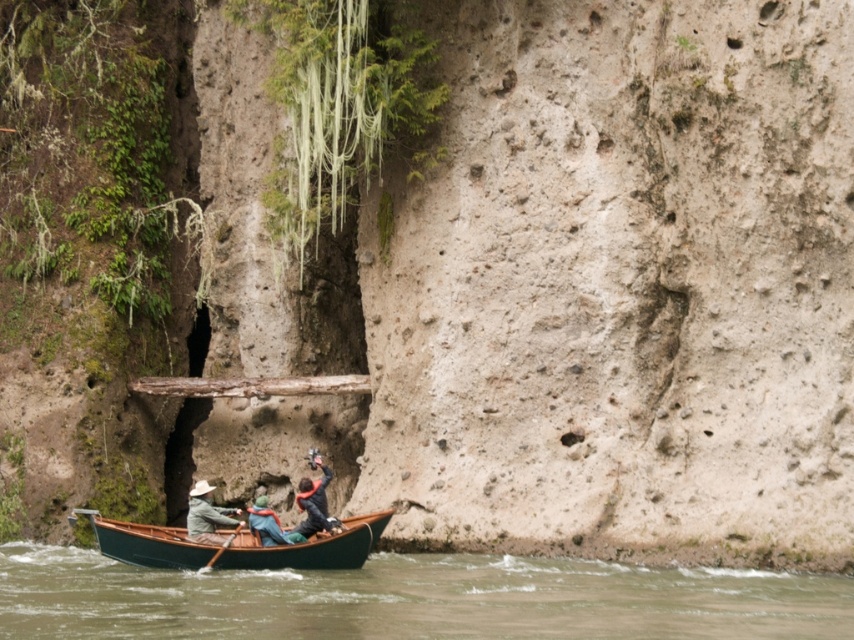
Question: Among these points, which one is farthest from the camera?

Choices:
 (A) [x=219, y=538]
 (B) [x=214, y=561]
 (C) [x=294, y=544]

Answer: (A)

Question: Which point is closer to the camera taking this photo?

Choices:
 (A) [x=325, y=474]
 (B) [x=30, y=573]
 (C) [x=326, y=515]

Answer: (B)

Question: Is dark blue fabric jacket at center smaller than wooden paddle at lower center?

Choices:
 (A) yes
 (B) no

Answer: (B)

Question: Is the position of green polished wood boat at lower center less distant than that of wooden paddle at lower center?

Choices:
 (A) yes
 (B) no

Answer: (A)

Question: Which point appears closest to the camera in this image?

Choices:
 (A) (326, 513)
 (B) (211, 563)
 (C) (442, 580)
 (D) (273, 557)

Answer: (C)

Question: Can you confirm if green polished wood boat at lower center is positioned to the left of dark blue fabric jacket at center?

Choices:
 (A) no
 (B) yes

Answer: (B)